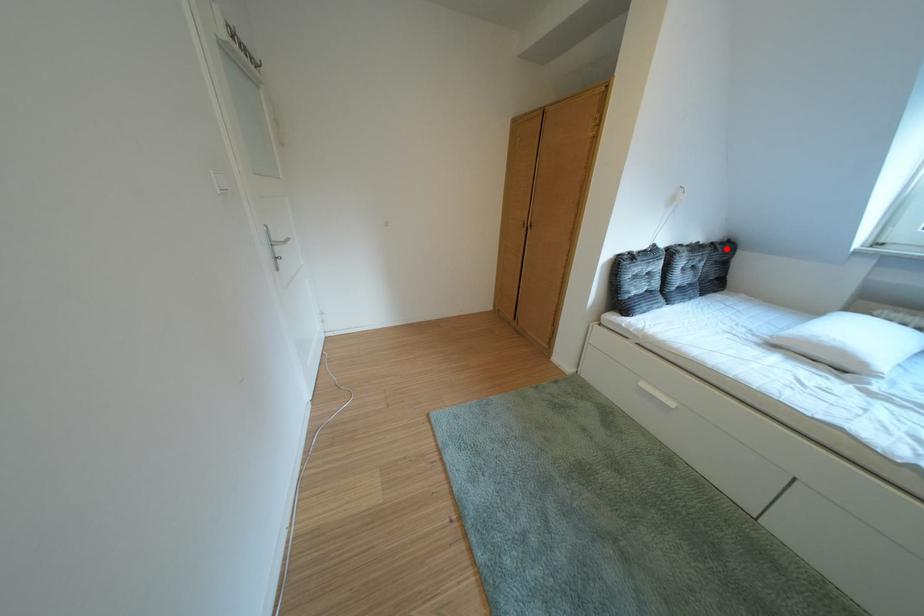
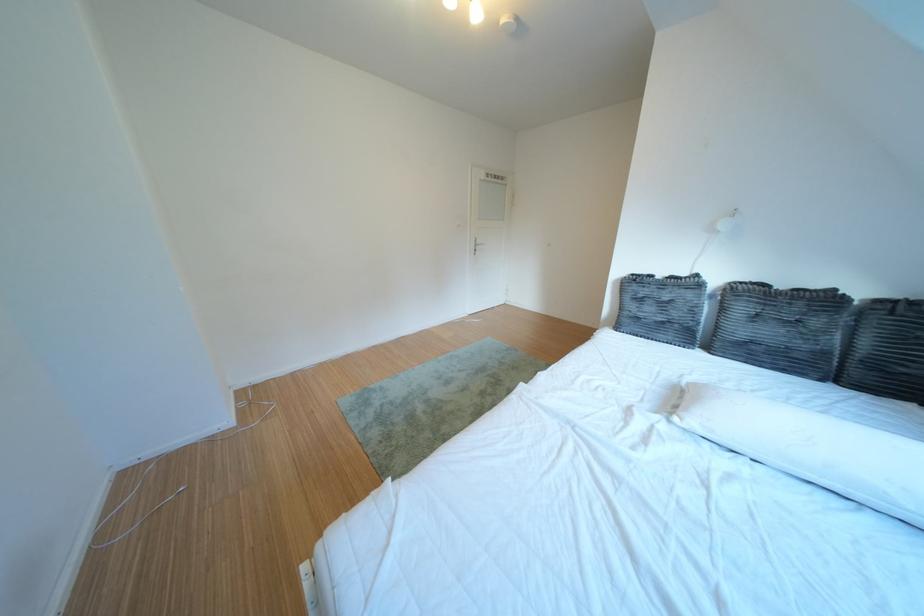
Find the pixel in the second image that matches the highlighted location in the first image.

(910, 306)